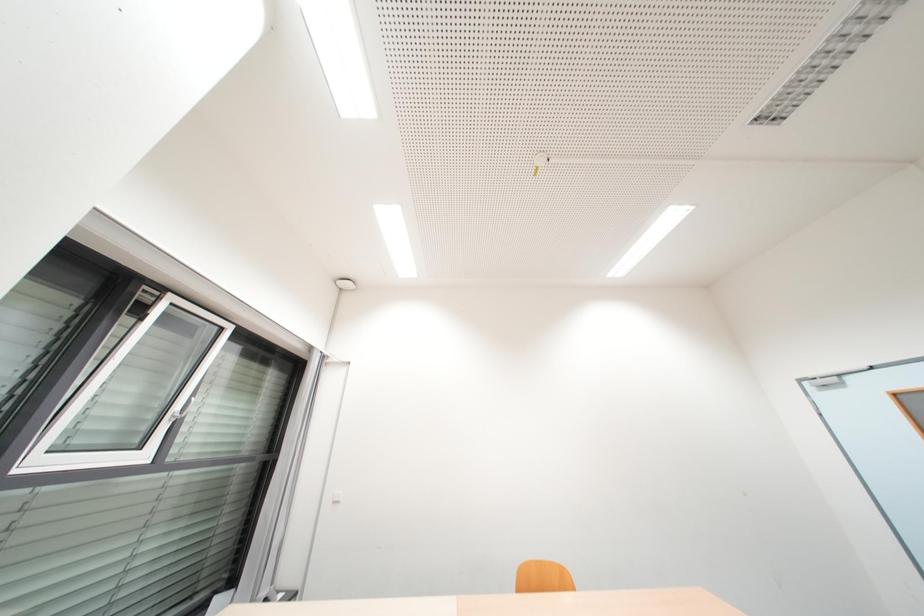
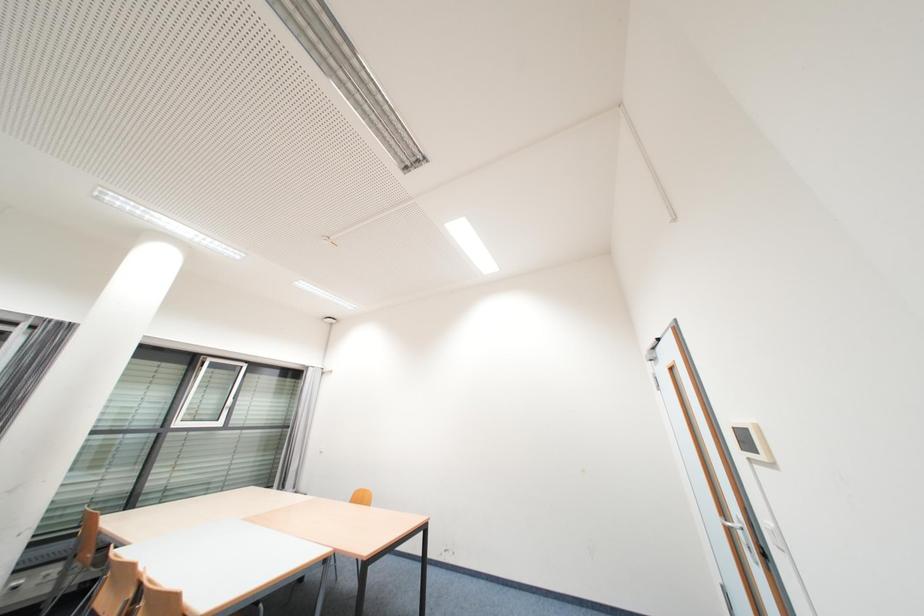
Question: What movement of the cameraman would produce the second image?

Choices:
 (A) Left
 (B) Right
 (C) Forward
 (D) Backward

Answer: (B)